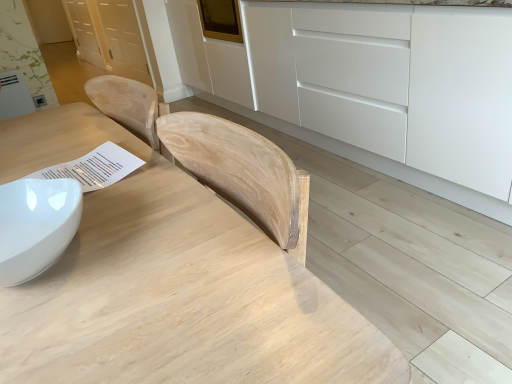
Question: From the image's perspective, is natural wood table at center located above white matte cabinet at center?

Choices:
 (A) no
 (B) yes

Answer: (A)

Question: Can you confirm if natural wood table at center is shorter than white matte cabinet at center?

Choices:
 (A) yes
 (B) no

Answer: (A)

Question: Is natural wood table at center thinner than white matte cabinet at center?

Choices:
 (A) no
 (B) yes

Answer: (B)

Question: Is natural wood table at center closer to camera compared to white matte cabinet at center?

Choices:
 (A) yes
 (B) no

Answer: (A)

Question: Can you confirm if natural wood table at center is bigger than white matte cabinet at center?

Choices:
 (A) no
 (B) yes

Answer: (A)

Question: Does natural wood table at center appear on the left side of white matte cabinet at center?

Choices:
 (A) no
 (B) yes

Answer: (B)

Question: Is white matte cabinet at center smaller than natural wood table at center?

Choices:
 (A) yes
 (B) no

Answer: (B)

Question: From the image's perspective, would you say white matte cabinet at center is shown under natural wood table at center?

Choices:
 (A) no
 (B) yes

Answer: (A)

Question: Are white matte cabinet at center and natural wood table at center far apart?

Choices:
 (A) yes
 (B) no

Answer: (A)

Question: Does white matte cabinet at center have a lesser width compared to natural wood table at center?

Choices:
 (A) no
 (B) yes

Answer: (A)

Question: From a real-world perspective, is white matte cabinet at center below natural wood table at center?

Choices:
 (A) yes
 (B) no

Answer: (A)

Question: Are white matte cabinet at center and natural wood table at center making contact?

Choices:
 (A) yes
 (B) no

Answer: (B)

Question: Does point (441, 117) appear closer or farther from the camera than point (242, 344)?

Choices:
 (A) closer
 (B) farther

Answer: (B)